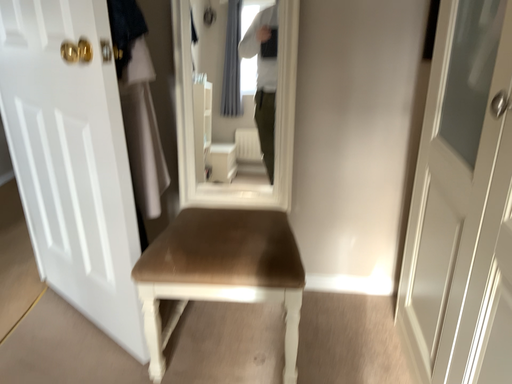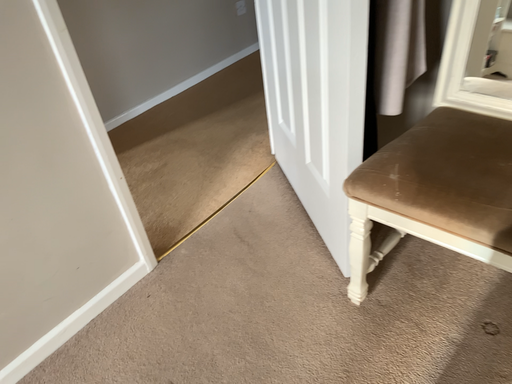
Question: Which way did the camera rotate in the video?

Choices:
 (A) rotated upward
 (B) rotated downward

Answer: (B)